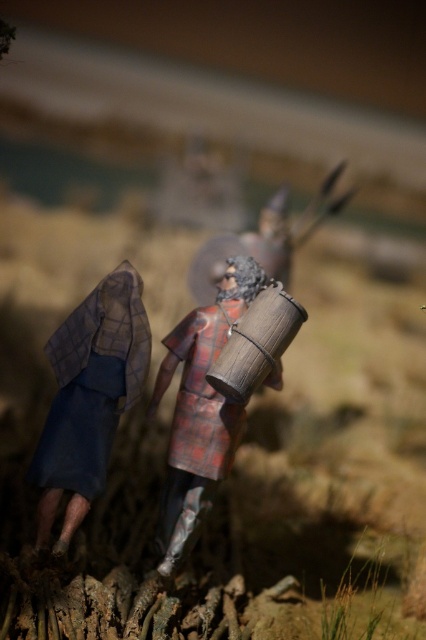
You are a painter setting up a canvas to paint the scene. You need to decide which object to paint first based on their sizes. Since the blue fabric cloak at left is thinner than the wooden barrel at center, which object should you paint first if you want to paint the larger object first?

The wooden barrel at center is larger than the blue fabric cloak at left, so you should paint the wooden barrel at center first.

You are standing in front of the diorama and want to know how far the point marked at coordinates point (75,387) is from you. Can you determine the distance?

The point marked at coordinates point (75,387) is 4.78 feet away from the viewer.

You are an artist trying to sketch the scene. You need to locate the blue fabric cloak at left in the image. Where exactly should you look?

You should look at point (89, 396) to find the blue fabric cloak at left.